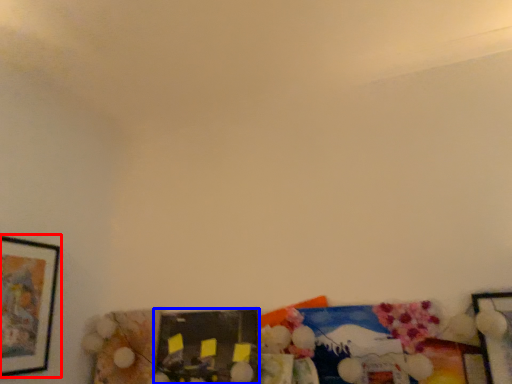
Question: Which object is closer to the camera taking this photo, picture frame (highlighted by a red box) or picture frame (highlighted by a blue box)?

Choices:
 (A) picture frame
 (B) picture frame

Answer: (A)